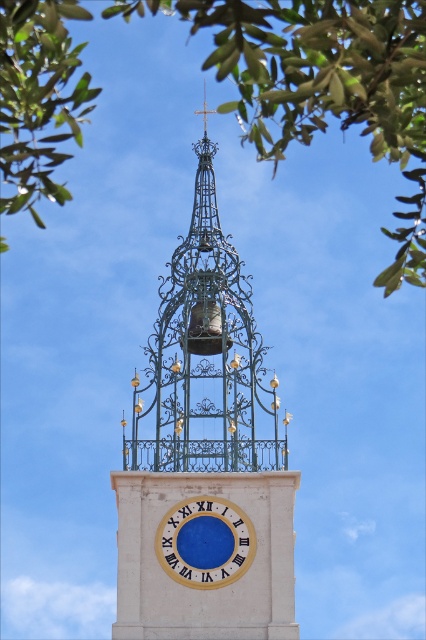
You are standing in front of the bell tower and notice two green leafy trees framing the top of the image. Which tree is positioned closer to you, the green leafy tree at upper center or the green leafy tree at upper left?

The green leafy tree at upper center is closer to the viewer than the green leafy tree at upper left.

You are an architect designing a new bell tower and want to incorporate elements from this image. If you want to maintain visual balance between the green leafy tree at upper center and the blue wooden clock at center, which element should you make smaller in your design?

The green leafy tree at upper center is larger in size than the blue wooden clock at center. To maintain visual balance, you should make the blue wooden clock at center larger or the green leafy tree at upper center smaller in your design.

You are standing at the base of the bell tower and looking upwards. Which of the two green leafy trees, the green leafy tree at upper center or the green leafy tree at upper left, appears closer to you?

The green leafy tree at upper center appears closer because it is positioned over the green leafy tree at upper left, meaning it is in front of it from your viewpoint.